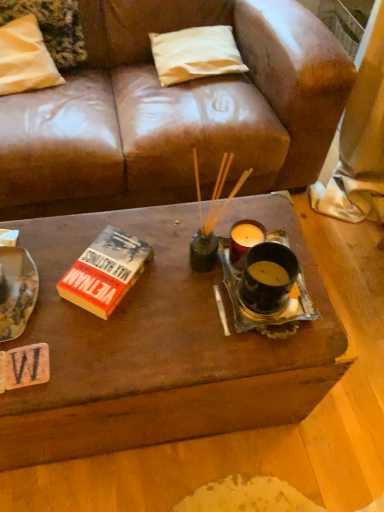
Question: Considering the positions of point (3, 56) and point (135, 266), is point (3, 56) closer or farther from the camera than point (135, 266)?

Choices:
 (A) closer
 (B) farther

Answer: (B)

Question: In terms of width, does white fabric pillow at upper left, positioned as the 2th pillow in right-to-left order, look wider or thinner when compared to hardcover book at center-left?

Choices:
 (A) thin
 (B) wide

Answer: (B)

Question: Based on their relative distances, which object is farther from the hardcover book at center-left?

Choices:
 (A) white fabric pillow at upper left, the first pillow from the left
 (B) white fabric pillow at upper center, which is the first pillow in right-to-left order

Answer: (B)

Question: Which of these objects is positioned farthest from the white fabric pillow at upper center, the second pillow when ordered from left to right?

Choices:
 (A) hardcover book at center-left
 (B) white fabric pillow at upper left, positioned as the 2th pillow in right-to-left order

Answer: (A)